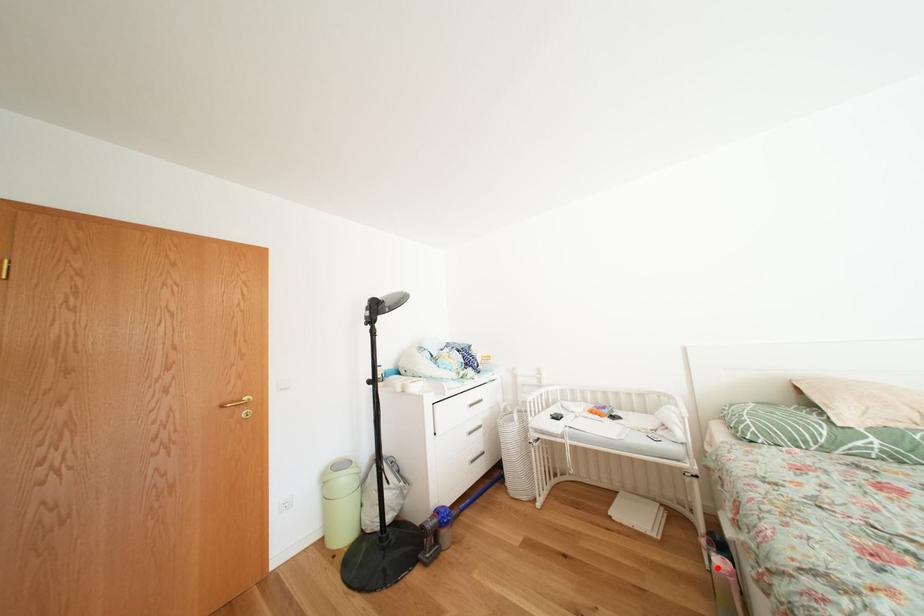
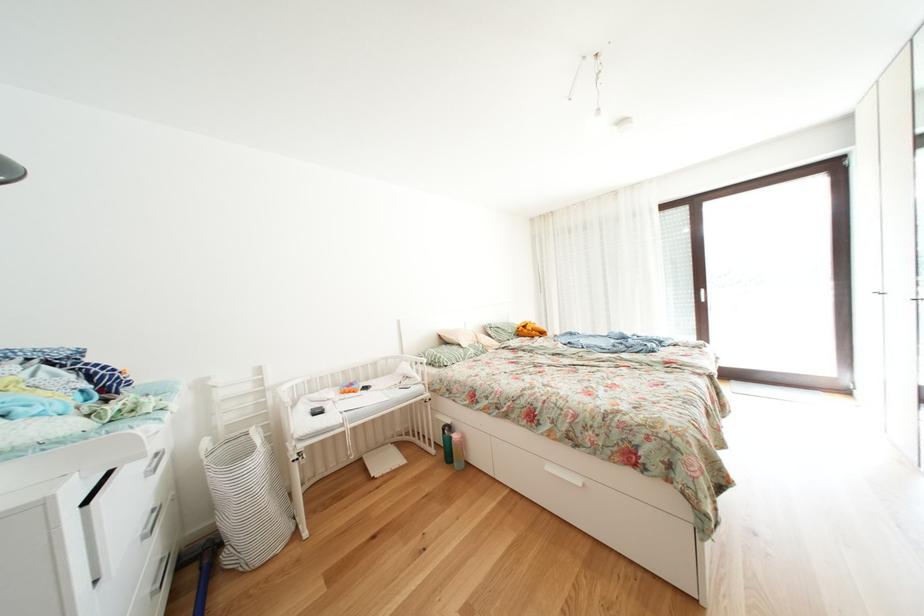
Where in the second image is the point corresponding to the highlighted location from the first image?

(443, 456)